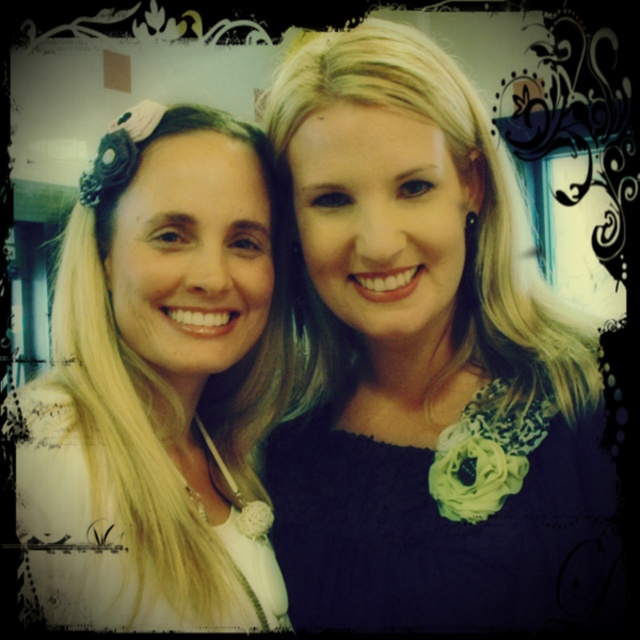
Question: Does matte black dress at center have a larger size compared to white lace top at left?

Choices:
 (A) no
 (B) yes

Answer: (B)

Question: In this image, where is matte black dress at center located relative to white lace top at left?

Choices:
 (A) left
 (B) right

Answer: (B)

Question: Is matte black dress at center in front of white lace top at left?

Choices:
 (A) yes
 (B) no

Answer: (B)

Question: Which point is farther from the camera taking this photo?

Choices:
 (A) (387, 180)
 (B) (237, 349)

Answer: (B)

Question: Which of the following is the closest to the observer?

Choices:
 (A) (172, 150)
 (B) (550, 490)

Answer: (B)